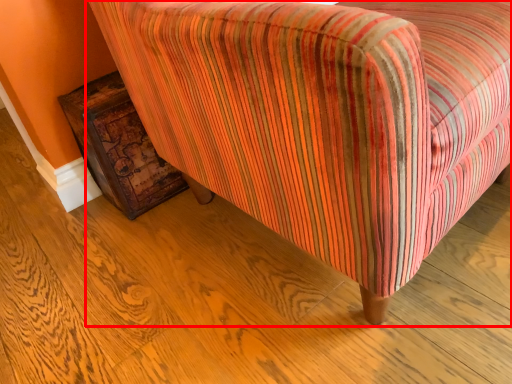
Question: Considering the relative positions of chair (annotated by the red box) and furniture in the image provided, where is chair (annotated by the red box) located with respect to the staircase?

Choices:
 (A) left
 (B) right

Answer: (B)